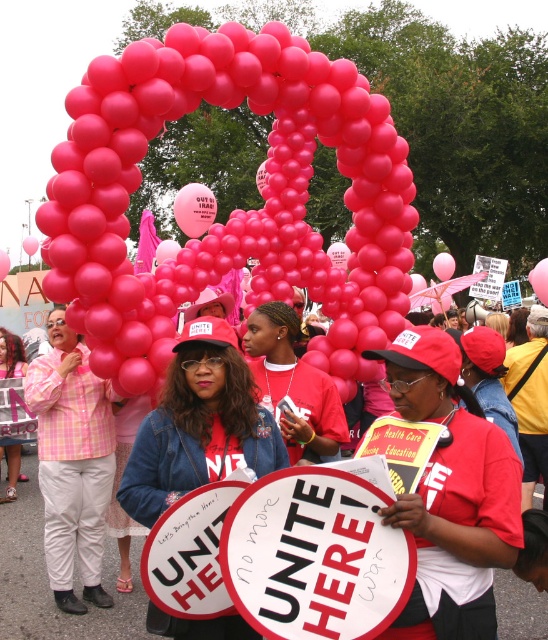
Who is positioned more to the right, white paper sign at center or matte red shirt at center?

From the viewer's perspective, white paper sign at center appears more on the right side.

Who is more distant from viewer, (x=299, y=612) or (x=293, y=404)?

Positioned behind is point (x=293, y=404).

Image resolution: width=548 pixels, height=640 pixels. What are the coordinates of `white paper sign at center` in the screenshot? It's located at (316, 554).

Can you confirm if pink balloons at center is taller than matte pink shirt at center?

In fact, pink balloons at center may be shorter than matte pink shirt at center.

Between pink balloons at center and matte pink shirt at center, which one has less height?

Standing shorter between the two is pink balloons at center.

Where is `pink balloons at center`? The image size is (548, 640). pink balloons at center is located at coordinates (242, 209).

Where is `pink balloons at center`? This screenshot has height=640, width=548. pink balloons at center is located at coordinates (242, 209).

Can you confirm if denim jacket at center is thinner than matte red shirt at center?

In fact, denim jacket at center might be wider than matte red shirt at center.

Is point (212, 420) closer to camera compared to point (309, 444)?

Yes, it is in front of point (309, 444).

Identify the location of denim jacket at center. Image resolution: width=548 pixels, height=640 pixels. (199, 424).